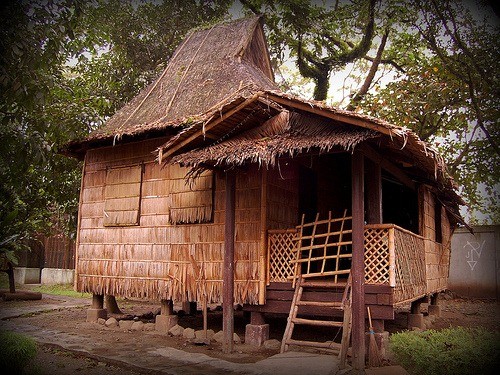
Locate an element on the screen. The height and width of the screenshot is (375, 500). broom is located at coordinates (375, 349).